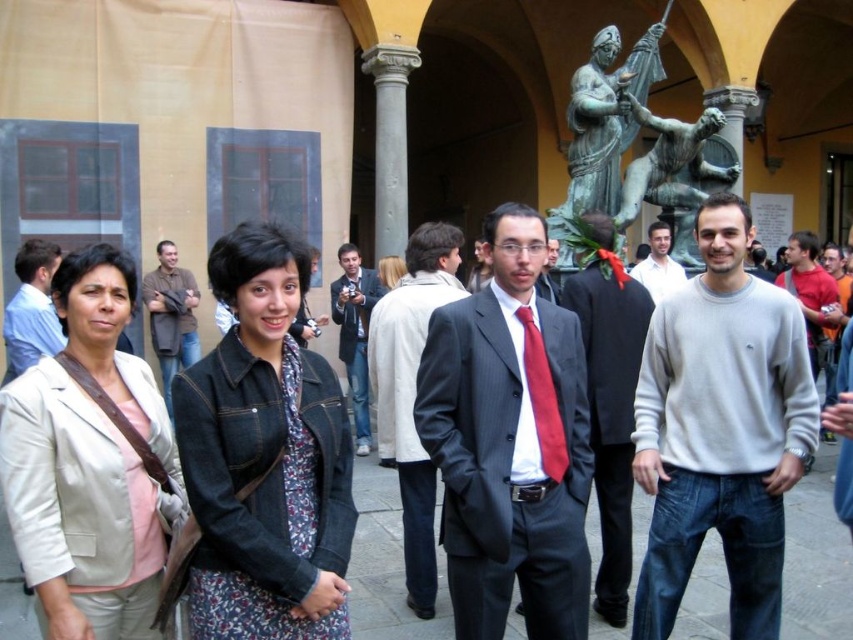
Is red cotton sweater at right smaller than red silk tie at center?

No, red cotton sweater at right is not smaller than red silk tie at center.

Between red cotton sweater at right and red silk tie at center, which one has less height?

red silk tie at center

The height and width of the screenshot is (640, 853). Find the location of `red cotton sweater at right`. red cotton sweater at right is located at coordinates (810, 296).

This screenshot has height=640, width=853. I want to click on matte gray sweater at center, so click(x=610, y=400).

Based on the photo, is matte gray sweater at center bigger than gray sweater at center?

No.

This screenshot has width=853, height=640. What do you see at coordinates (610, 400) in the screenshot?
I see `matte gray sweater at center` at bounding box center [610, 400].

Where is `matte gray sweater at center`? matte gray sweater at center is located at coordinates (x=610, y=400).

Is point (758, 368) positioned in front of point (346, 320)?

Yes, point (758, 368) is in front of point (346, 320).

Does gray cotton sweater at center come in front of blue denim jeans at center?

Yes, it is.

Measure the distance between gray cotton sweater at center and camera.

gray cotton sweater at center is 16.54 meters from camera.

At what (x,y) coordinates should I click in order to perform the action: click on gray cotton sweater at center. Please return your answer as a coordinate pair (x, y). The height and width of the screenshot is (640, 853). Looking at the image, I should click on (721, 429).